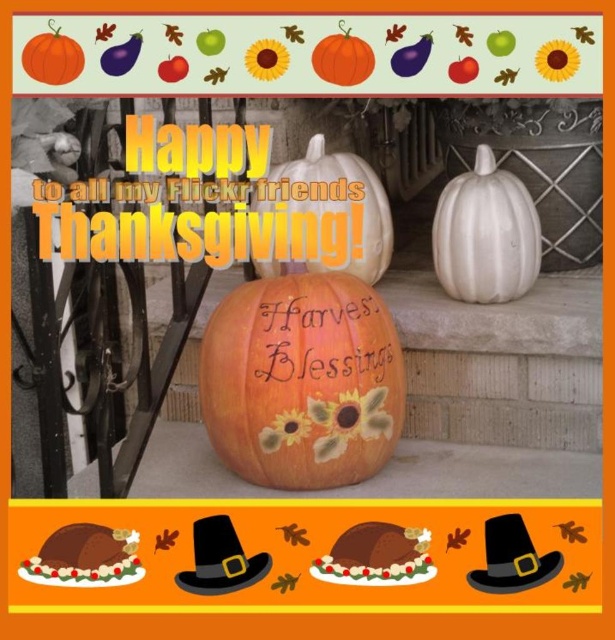
Question: Which point is farther to the camera?

Choices:
 (A) orange matte pumpkin at center
 (B) matte orange pumpkin at upper left
 (C) matte orange pumpkin at center

Answer: (A)

Question: Estimate the real-world distances between objects in this image. Which object is farther from the white ceramic pumpkin at center?

Choices:
 (A) matte orange pumpkin at upper left
 (B) white matte pumpkin at center

Answer: (A)

Question: Is white matte pumpkin at center further to the viewer compared to matte orange pumpkin at upper left?

Choices:
 (A) yes
 (B) no

Answer: (A)

Question: Which object appears closest to the camera in this image?

Choices:
 (A) white matte pumpkin at center
 (B) white ceramic pumpkin at center
 (C) matte orange pumpkin at center
 (D) matte orange pumpkin at upper left

Answer: (D)

Question: Does matte orange pumpkin at upper left appear over matte orange pumpkin at center?

Choices:
 (A) yes
 (B) no

Answer: (B)

Question: Does white ceramic pumpkin at center come in front of matte orange pumpkin at center?

Choices:
 (A) no
 (B) yes

Answer: (A)